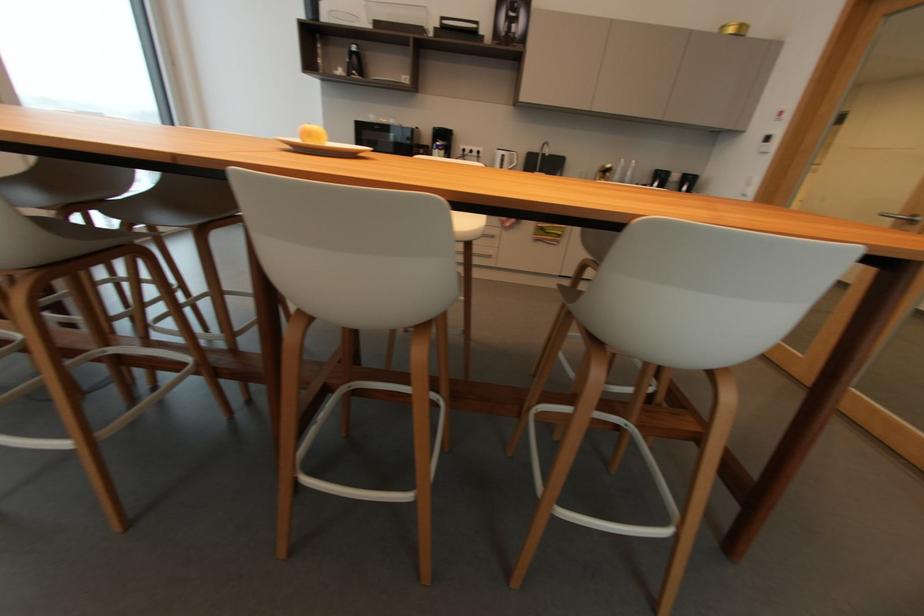
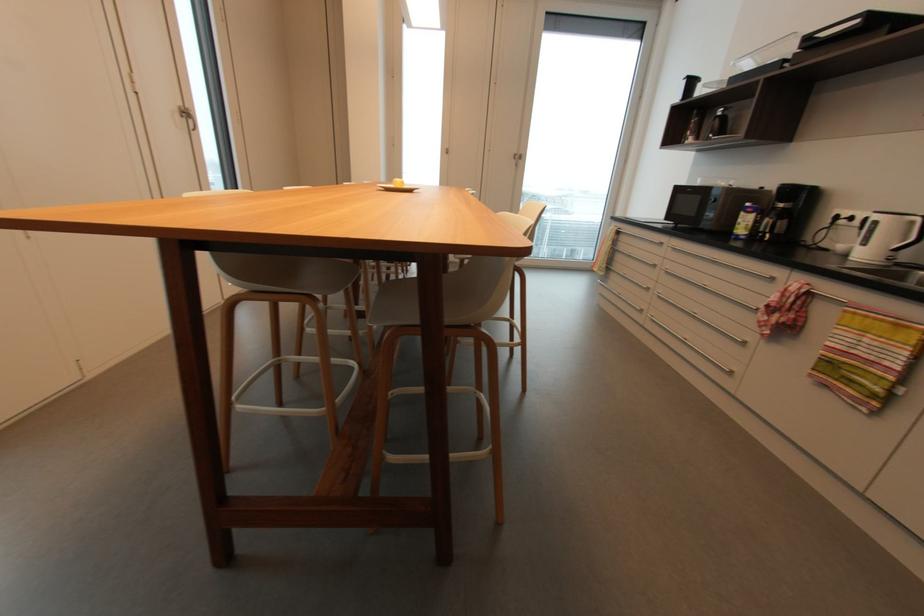
Find the pixel in the second image that matches point 441,144 in the first image.

(750, 205)